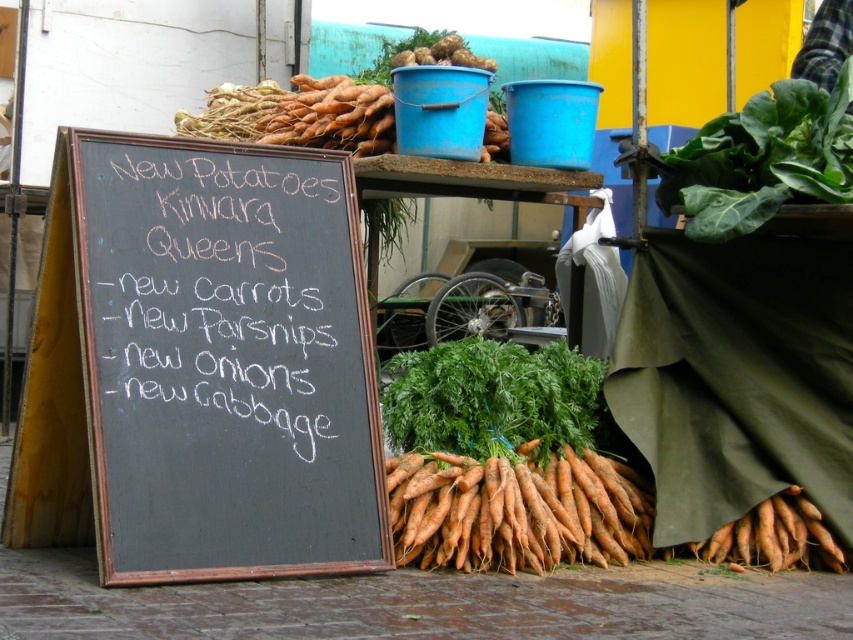
Question: Among these objects, which one is nearest to the camera?

Choices:
 (A) black chalkboard at center
 (B) green leafy carrot at center
 (C) green leafy at upper right
 (D) orange matte carrots at center

Answer: (A)

Question: Based on their relative distances, which object is farther from the green leafy at upper right?

Choices:
 (A) green leafy carrot at center
 (B) black chalkboard at center

Answer: (B)

Question: Can you confirm if black chalkboard at center is positioned above white chalk/blackboard at left?

Choices:
 (A) no
 (B) yes

Answer: (A)

Question: Does green leafy at upper right appear over orange matte carrots at upper center?

Choices:
 (A) no
 (B) yes

Answer: (A)

Question: Which point is closer to the camera?

Choices:
 (A) (561, 540)
 (B) (469, 349)

Answer: (A)

Question: Observing the image, what is the correct spatial positioning of black chalkboard at center in reference to orange matte carrots at upper center?

Choices:
 (A) below
 (B) above

Answer: (A)